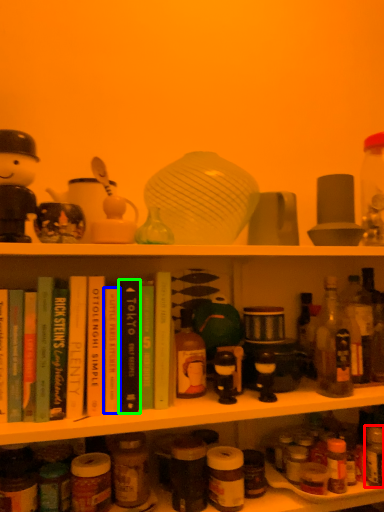
Question: Which object is the closest to the bottle (highlighted by a red box)? Choose among these: book (highlighted by a blue box) or book (highlighted by a green box).

Choices:
 (A) book
 (B) book

Answer: (B)